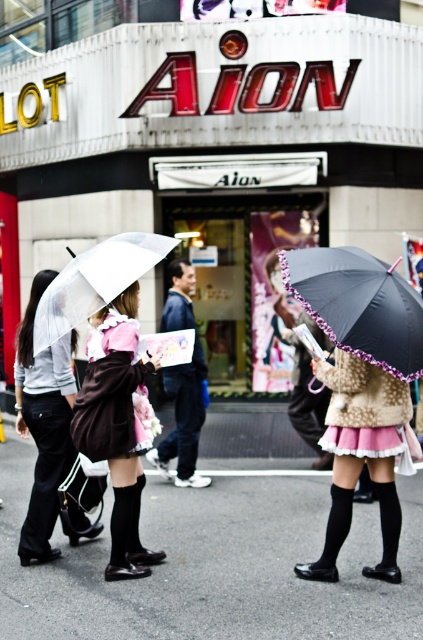
Question: Can you confirm if velvet pink dress at center is positioned below pink satin skirt at center?

Choices:
 (A) yes
 (B) no

Answer: (B)

Question: Which object appears farthest from the camera in this image?

Choices:
 (A) black matte umbrella at center
 (B) transparent plastic umbrella at center
 (C) matte pink skirt at center

Answer: (C)

Question: Which object is farther from the camera taking this photo?

Choices:
 (A) pink satin skirt at center
 (B) velvet pink dress at center
 (C) transparent plastic umbrella at center
 (D) matte pink skirt at center

Answer: (B)

Question: Is matte black umbrella at left above transparent plastic umbrella at center?

Choices:
 (A) yes
 (B) no

Answer: (B)

Question: Is matte pink skirt at center positioned before matte black umbrella at left?

Choices:
 (A) no
 (B) yes

Answer: (B)

Question: Among these points, which one is farthest from the camera?

Choices:
 (A) [x=115, y=333]
 (B) [x=384, y=378]

Answer: (A)